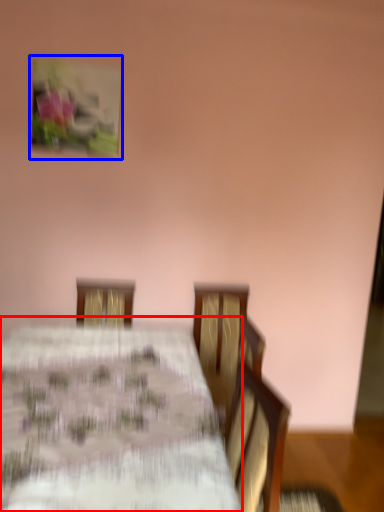
Question: Among these objects, which one is farthest to the camera, table (highlighted by a red box) or picture frame (highlighted by a blue box)?

Choices:
 (A) table
 (B) picture frame

Answer: (B)